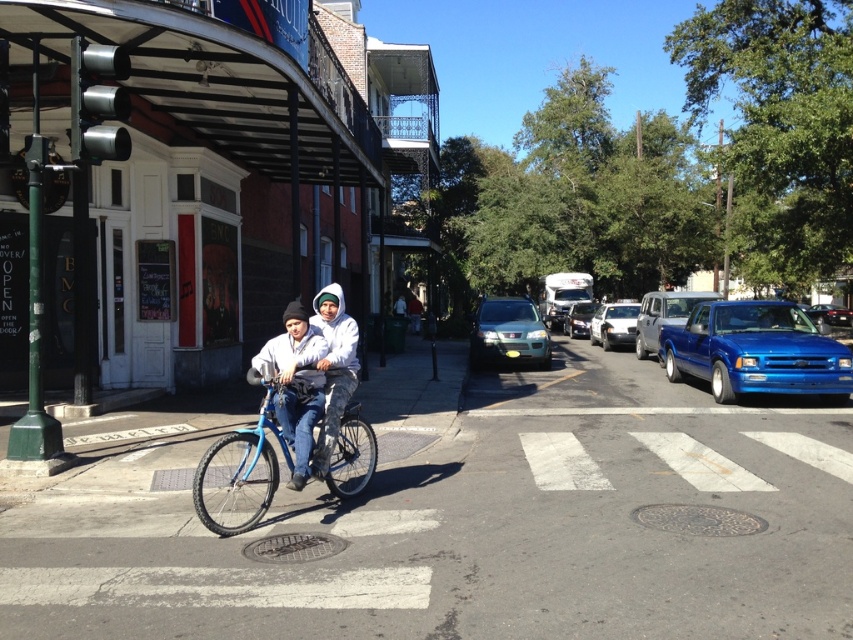
Between blue metallic bicycle at center and white matte sedan at center, which one has more height?

white matte sedan at center is taller.

From the picture: Can you confirm if blue metallic bicycle at center is positioned above white matte sedan at center?

Actually, blue metallic bicycle at center is below white matte sedan at center.

Is point (201, 461) less distant than point (619, 301)?

That is True.

The height and width of the screenshot is (640, 853). I want to click on blue metallic bicycle at center, so click(x=241, y=470).

Can you confirm if satin silver suv at center is thinner than silver metallic suv at center?

Yes.

Can you confirm if satin silver suv at center is bigger than silver metallic suv at center?

Incorrect, satin silver suv at center is not larger than silver metallic suv at center.

Identify the location of satin silver suv at center. This screenshot has height=640, width=853. (508, 333).

Where is `satin silver suv at center`? satin silver suv at center is located at coordinates (508, 333).

Which of these two, white matte jacket at center or white fleece jacket at center, stands shorter?

Standing shorter between the two is white matte jacket at center.

Who is positioned more to the right, white matte jacket at center or white fleece jacket at center?

white fleece jacket at center is more to the right.

You are a GUI agent. You are given a task and a screenshot of the screen. Output one action in this format:
    pyautogui.click(x=<x>, y=<y>)
    Task: Click on the white matte jacket at center
    This screenshot has width=853, height=640.
    Given the screenshot: What is the action you would take?
    pyautogui.click(x=296, y=385)